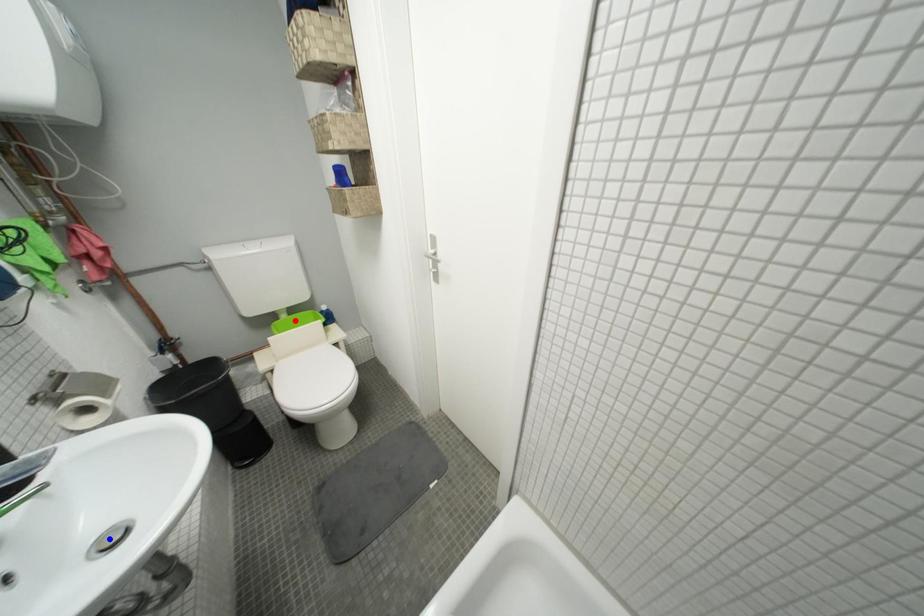
Question: In the image, two points are highlighted. Which point is nearer to the camera? Reply with the corresponding letter.

Choices:
 (A) blue point
 (B) red point

Answer: (A)